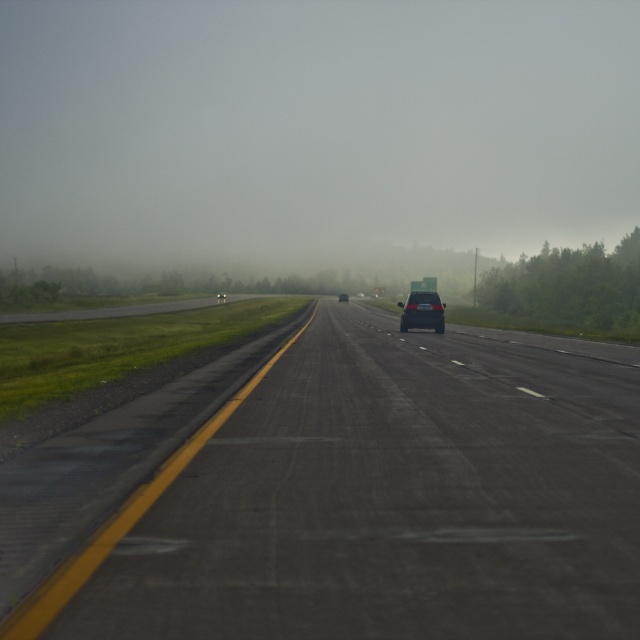
Question: Where is black asphalt runway at center located in relation to satin black suv at center in the image?

Choices:
 (A) left
 (B) right

Answer: (A)

Question: Does black asphalt runway at center have a greater width compared to satin black suv at center?

Choices:
 (A) yes
 (B) no

Answer: (A)

Question: Among these objects, which one is farthest from the camera?

Choices:
 (A) black asphalt runway at center
 (B) satin black suv at center

Answer: (B)

Question: Which point appears farthest from the camera in this image?

Choices:
 (A) (410, 308)
 (B) (625, 544)

Answer: (A)

Question: Does black asphalt runway at center appear over satin black suv at center?

Choices:
 (A) no
 (B) yes

Answer: (A)